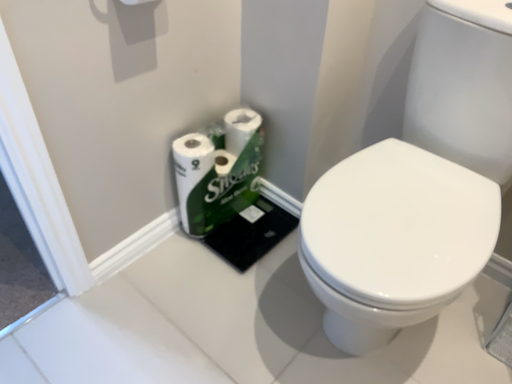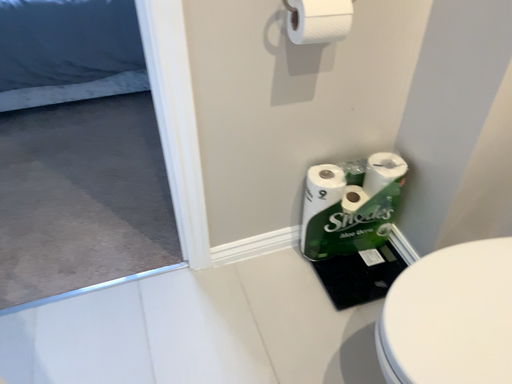
Question: Which way did the camera rotate in the video?

Choices:
 (A) rotated right
 (B) rotated left

Answer: (B)